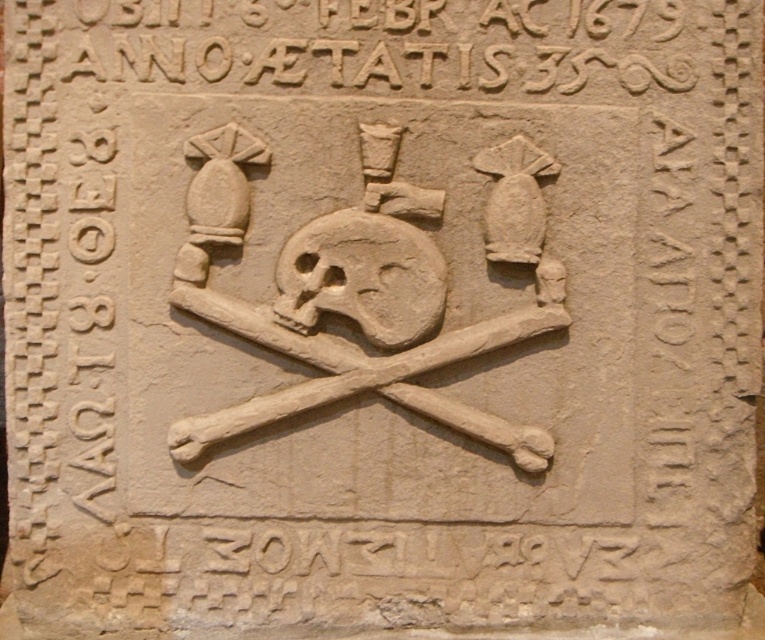
You are an archaeologist examining the memorial plaque. You notice two central carvings, the carved stone bones at center and the beige stone skull at center. Which of these two carvings is larger in height?

The carved stone bones at center is much taller than the beige stone skull at center.

You are an archaeologist examining the memorial plaque. You notice two central elements, the carved stone bones at center and the beige stone skull at center. Which of these two objects is wider?

The carved stone bones at center is wider than the beige stone skull at center, as its width surpasses that of the skull.